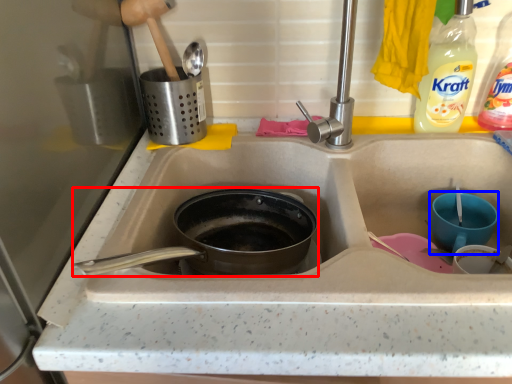
Question: Which object is further to the camera taking this photo, frying pan (highlighted by a red box) or basin (highlighted by a blue box)?

Choices:
 (A) frying pan
 (B) basin

Answer: (B)